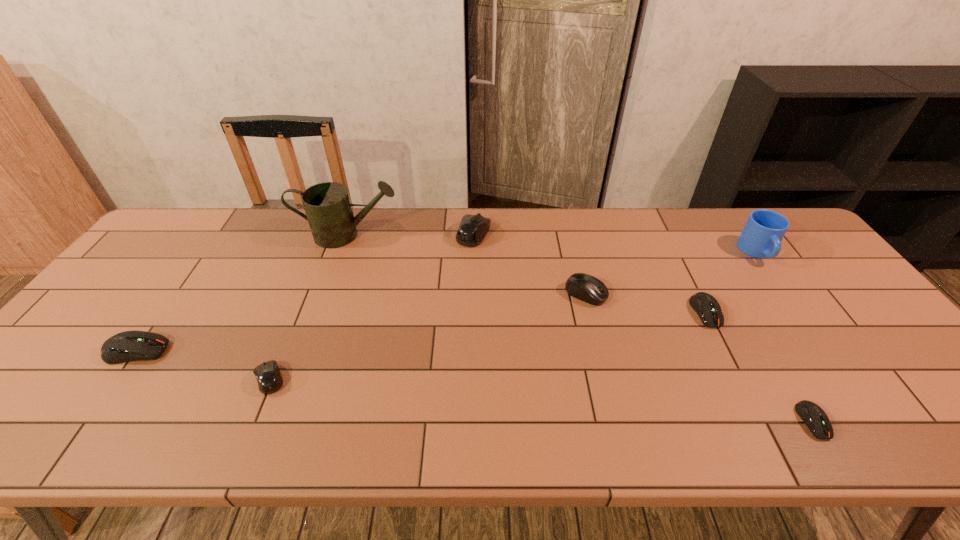
Locate an element on the screen. watering can is located at coordinates (327, 205).

Locate an element on the screen. Image resolution: width=960 pixels, height=540 pixels. the tallest object is located at coordinates (327, 205).

You are a GUI agent. You are given a task and a screenshot of the screen. Output one action in this format:
    pyautogui.click(x=<x>, y=<y>)
    Task: Click on the second tallest object
    The image size is (960, 540).
    Given the screenshot: What is the action you would take?
    pyautogui.click(x=761, y=237)

Identify the location of the rightmost object. (761, 237).

Find the location of a particular element. Image resolution: width=960 pixels, height=540 pixels. the farthest computer equipment is located at coordinates (473, 228).

Locate an element on the screen. This screenshot has width=960, height=540. the third tallest object is located at coordinates (473, 228).

This screenshot has width=960, height=540. What are the coordinates of `the second nearest black mouse` in the screenshot? It's located at (584, 287).

At what (x,y) coordinates should I click in order to perform the action: click on the fourth object from right to left. Please return your answer as a coordinate pair (x, y). The height and width of the screenshot is (540, 960). Looking at the image, I should click on (584, 287).

Where is `the leftmost object`? The height and width of the screenshot is (540, 960). the leftmost object is located at coordinates (127, 346).

Where is `the second farthest dark computer equipment`? This screenshot has width=960, height=540. the second farthest dark computer equipment is located at coordinates (127, 346).